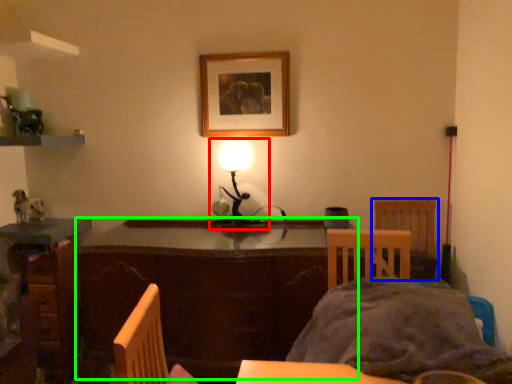
Question: Which object is the closest to the lamp (highlighted by a red box)? Choose among these: chair (highlighted by a blue box) or table (highlighted by a green box).

Choices:
 (A) chair
 (B) table

Answer: (B)